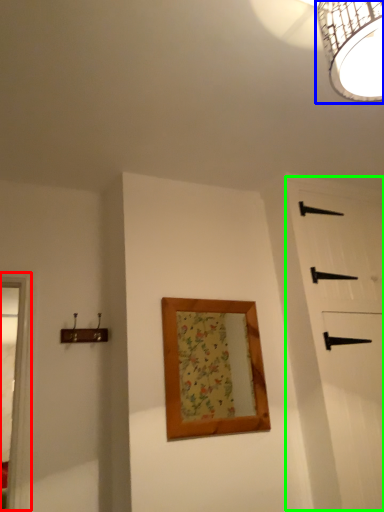
Question: Estimate the real-world distances between objects in this image. Which object is farther from window frame (highlighted by a red box), lamp (highlighted by a blue box) or barn door (highlighted by a green box)?

Choices:
 (A) lamp
 (B) barn door

Answer: (A)